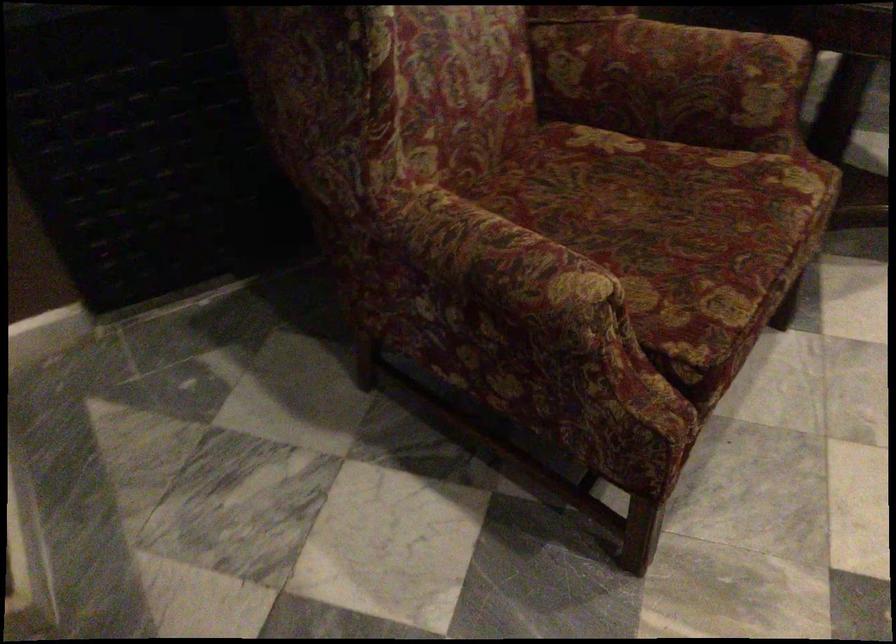
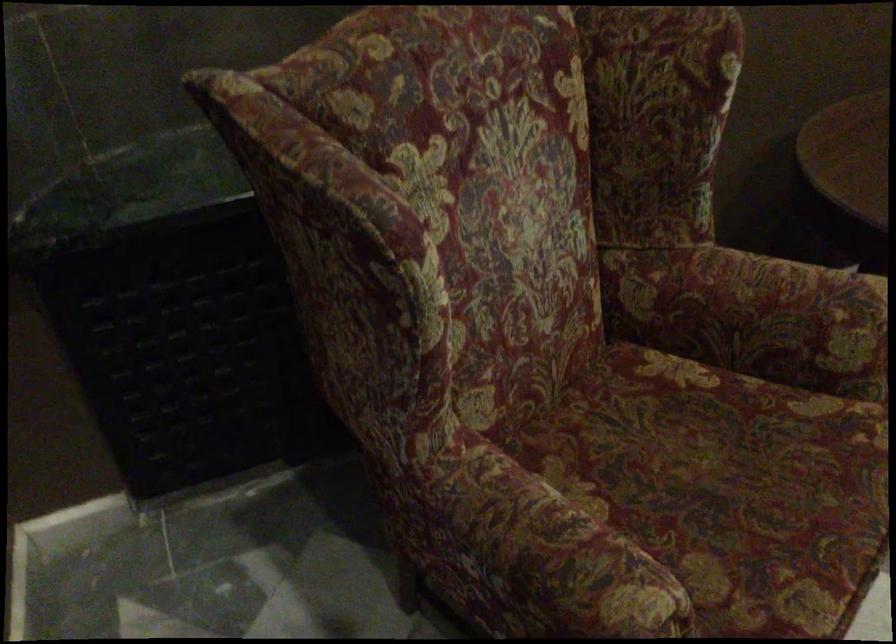
In the second image, find the point that corresponds to point (494, 265) in the first image.

(543, 559)